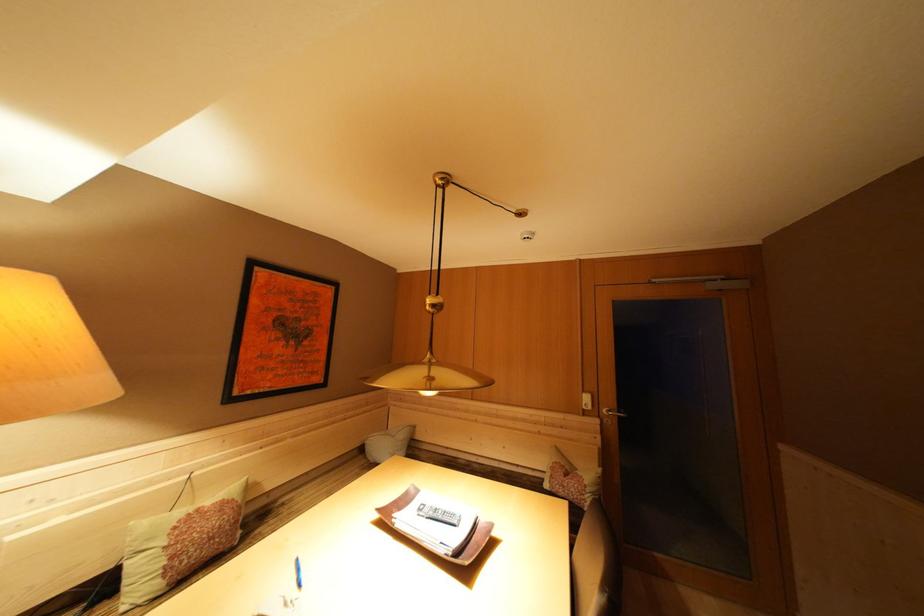
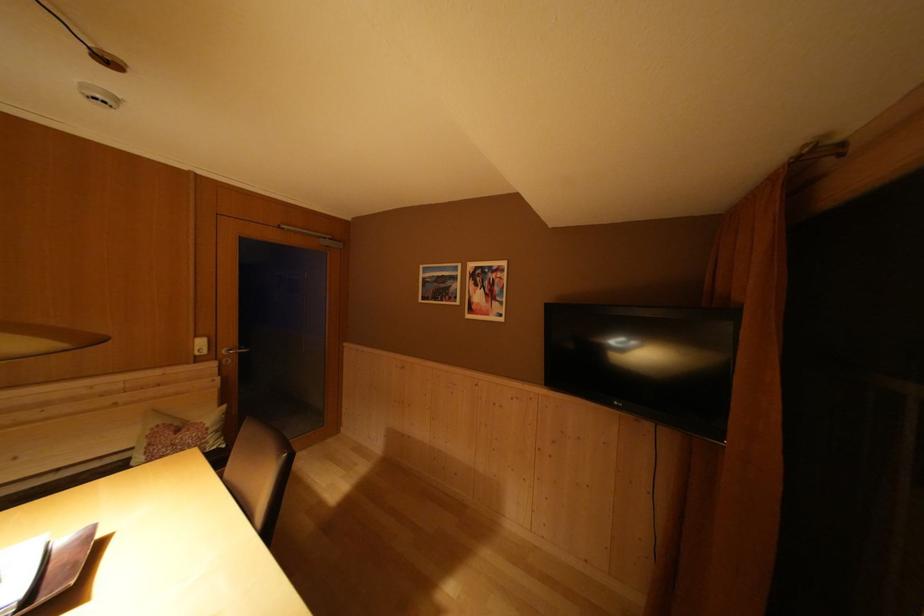
Question: The first image is from the beginning of the video and the second image is from the end. How did the camera likely rotate when shooting the video?

Choices:
 (A) Left
 (B) Right
 (C) Up
 (D) Down

Answer: (B)